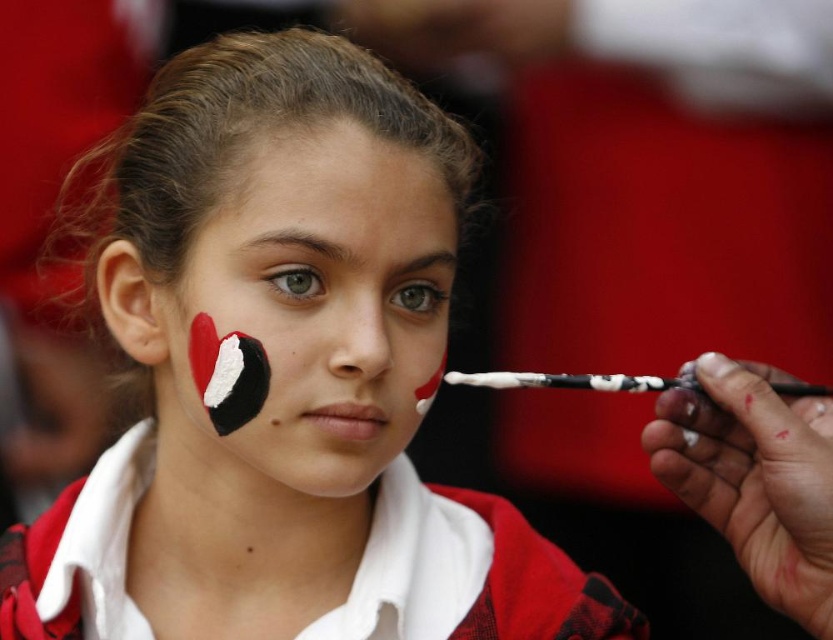
Between matte black face paint at center and white matte paint at center, which one appears on the right side from the viewer's perspective?

white matte paint at center

Is matte black face paint at center to the right of white matte paint at center from the viewer's perspective?

In fact, matte black face paint at center is to the left of white matte paint at center.

Which is behind, point (83, 168) or point (382, 422)?

The point (83, 168) is more distant.

Locate an element on the screen. This screenshot has width=833, height=640. matte black face paint at center is located at coordinates (283, 378).